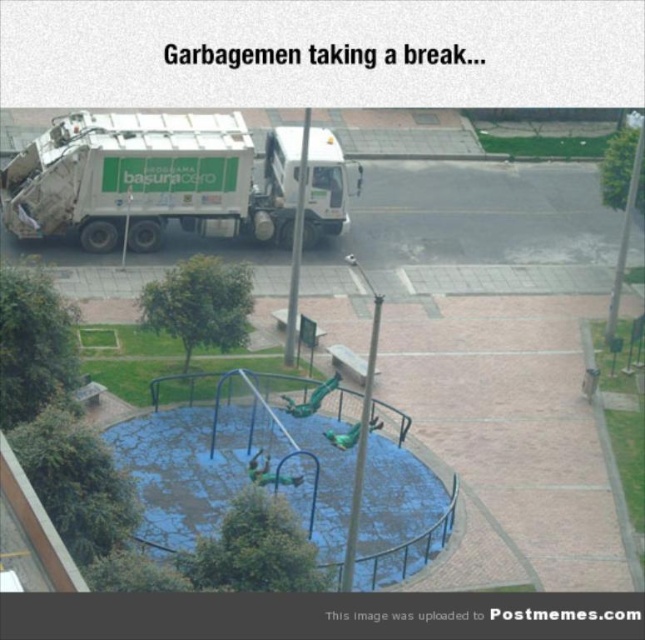
Can you confirm if white glossy garbage truck at left is taller than blue cracked plastic at center?

Yes, white glossy garbage truck at left is taller than blue cracked plastic at center.

What do you see at coordinates (172, 180) in the screenshot?
I see `white glossy garbage truck at left` at bounding box center [172, 180].

Is point (337, 202) positioned before point (179, 417)?

No, it is behind (179, 417).

Find the location of a particular element. white glossy garbage truck at left is located at coordinates (172, 180).